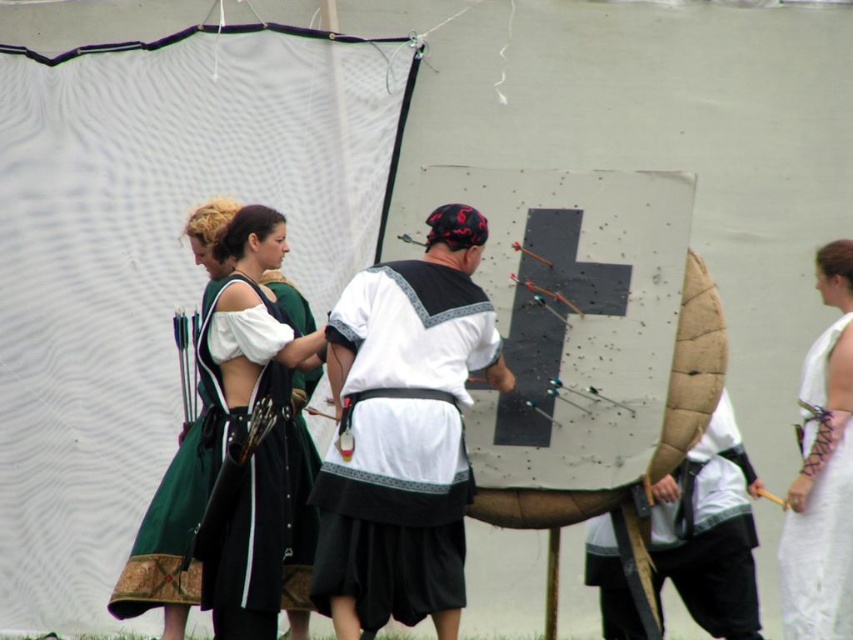
Question: Is brown leather shield at center behind white lace cloth at right?

Choices:
 (A) no
 (B) yes

Answer: (A)

Question: Is brown leather shield at center bigger than green velvet dress at center?

Choices:
 (A) no
 (B) yes

Answer: (A)

Question: Based on their relative distances, which object is farther from the white lace cloth at right?

Choices:
 (A) white cotton shirt at center
 (B) brown leather shield at center
 (C) green velvet dress at center

Answer: (C)

Question: Can you confirm if brown leather shield at center is positioned to the left of green velvet dress at center?

Choices:
 (A) no
 (B) yes

Answer: (A)

Question: Which object is closer to the camera taking this photo?

Choices:
 (A) green velvet dress at center
 (B) white cotton shirt at center
 (C) brown leather shield at center
 (D) white lace cloth at right

Answer: (B)

Question: Based on their relative distances, which object is nearer to the white lace cloth at right?

Choices:
 (A) white cotton shirt at center
 (B) brown leather shield at center

Answer: (B)